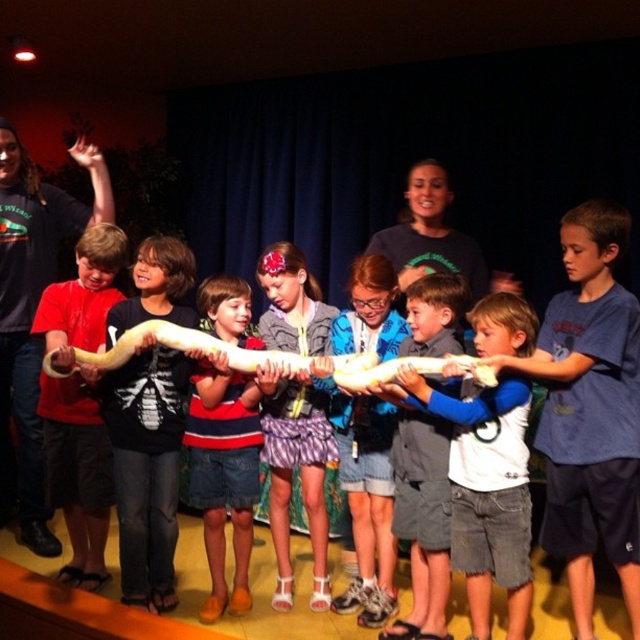
You are a photographer standing at the front of the stage. You want to take a photo of the children holding the snake. The two points in the image are part of the snake. Which point is closer to you, point A at point (317, 563) or point B at point (209, 552)?

Point B at point (209, 552) is closer to you because it is in front of point A at point (317, 563).